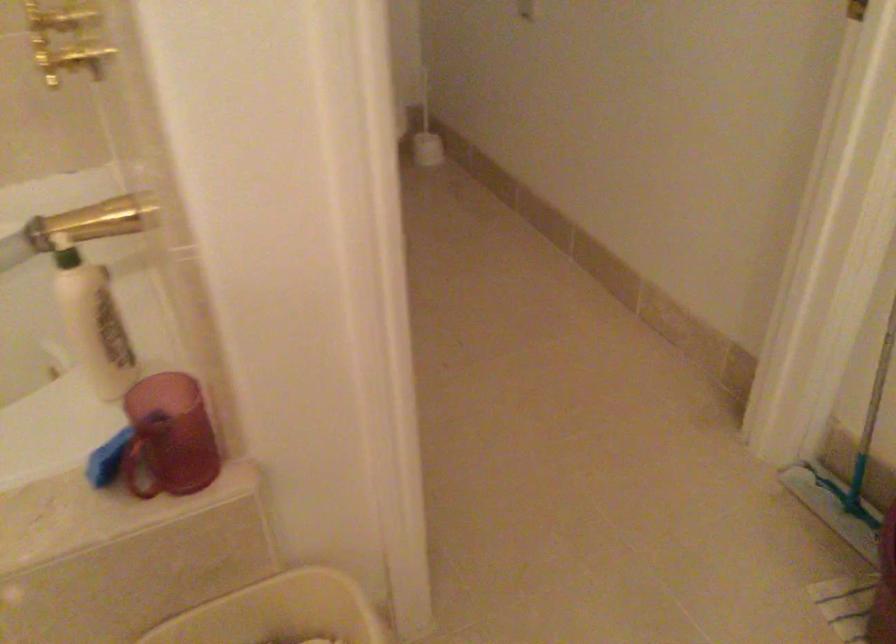
Identify the location of mop handle. This screenshot has width=896, height=644. (866, 431).